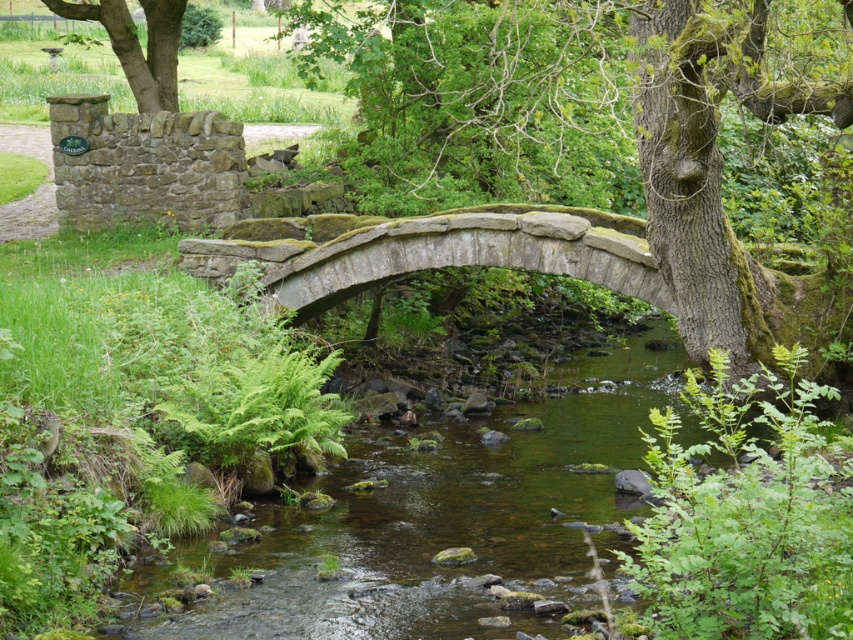
You are planning to cross the green mossy river at center using a wooden plank. The plank is as wide as the green mossy tree at upper left. Will the plank be wide enough to safely cross the river?

The green mossy river at center is wider than the green mossy tree at upper left. Since the plank is as wide as the tree, it will not be wide enough to safely cross the river.

You are an environmental scientist studying moss growth on trees in this area. You observe the green mossy bark tree at center and the green mossy tree at upper left. Which tree has more moss coverage based on their sizes?

The green mossy bark tree at center is bigger than the green mossy tree at upper left, so it likely has more moss coverage since larger trees typically provide more surface area for moss to grow.

You are standing on the green mossy river at center and want to reach the green mossy bark tree at center. Which direction should you move to get closer to the tree?

The green mossy river at center is shorter than the green mossy bark tree at center. Since the river is shorter, it is likely located below the tree. To reach the tree, you should move upward from the river.